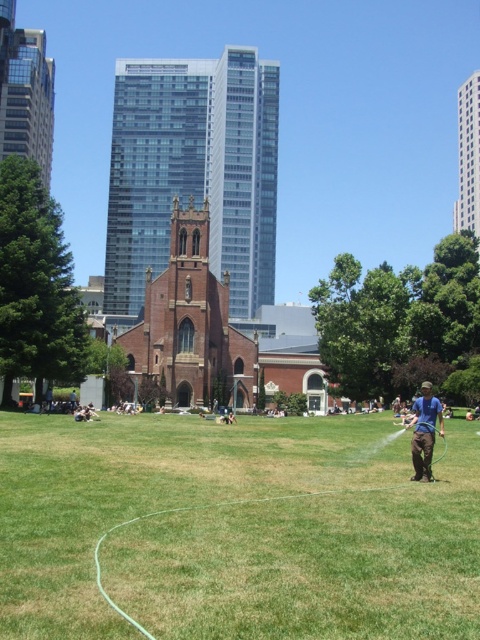
Question: Does green grass at center lie behind red brick church at center?

Choices:
 (A) no
 (B) yes

Answer: (A)

Question: Which point is farther from the camera taking this photo?

Choices:
 (A) (135, 529)
 (B) (460, 196)
 (C) (419, 467)
 (D) (204, 100)

Answer: (B)

Question: Can you confirm if red brick church at center is positioned to the right of blue fabric at right?

Choices:
 (A) no
 (B) yes

Answer: (A)

Question: Which point is farther from the camera taking this photo?

Choices:
 (A) (465, 99)
 (B) (239, 136)
 (C) (37, 428)

Answer: (A)

Question: Estimate the real-world distances between objects in this image. Which object is farther from the blue fabric at right?

Choices:
 (A) red brick church at center
 (B) brown stone church at center
 (C) green grass at center

Answer: (B)

Question: Is green grass at center above blue fabric at right?

Choices:
 (A) yes
 (B) no

Answer: (B)